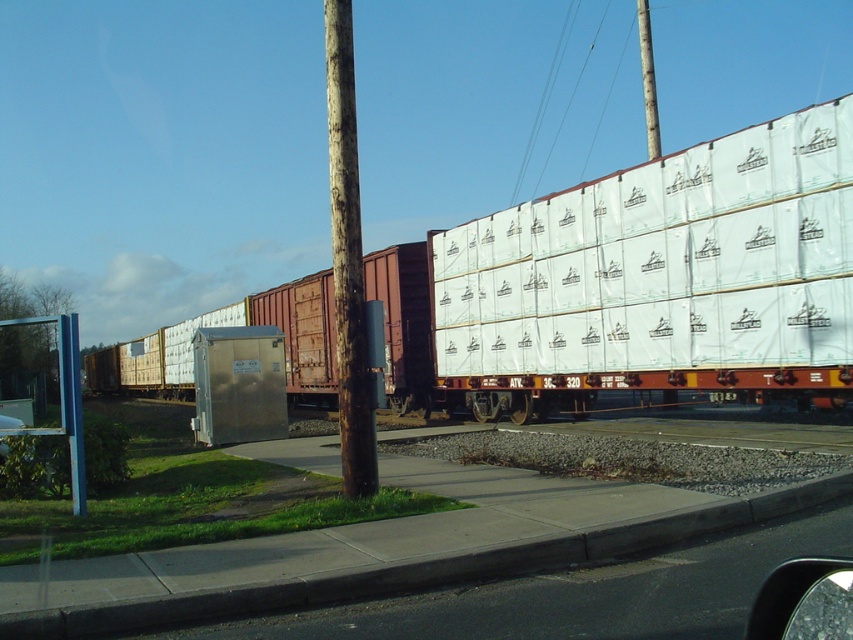
Question: Does white plastic containers at center appear under brown wooden pole at upper center?

Choices:
 (A) no
 (B) yes

Answer: (B)

Question: Is rusty wood pole at center to the left of brown wooden pole at upper center from the viewer's perspective?

Choices:
 (A) yes
 (B) no

Answer: (A)

Question: Does white plastic containers at center appear over rusty wood pole at center?

Choices:
 (A) no
 (B) yes

Answer: (A)

Question: Which object appears closest to the camera in this image?

Choices:
 (A) rusty wood pole at center
 (B) brown wooden pole at upper center

Answer: (A)

Question: Among these points, which one is farthest from the camera?

Choices:
 (A) (735, 330)
 (B) (338, 26)
 (C) (640, 61)

Answer: (C)

Question: Which point is farther from the camera taking this photo?

Choices:
 (A) (653, 86)
 (B) (408, 392)
 (C) (347, 497)

Answer: (A)